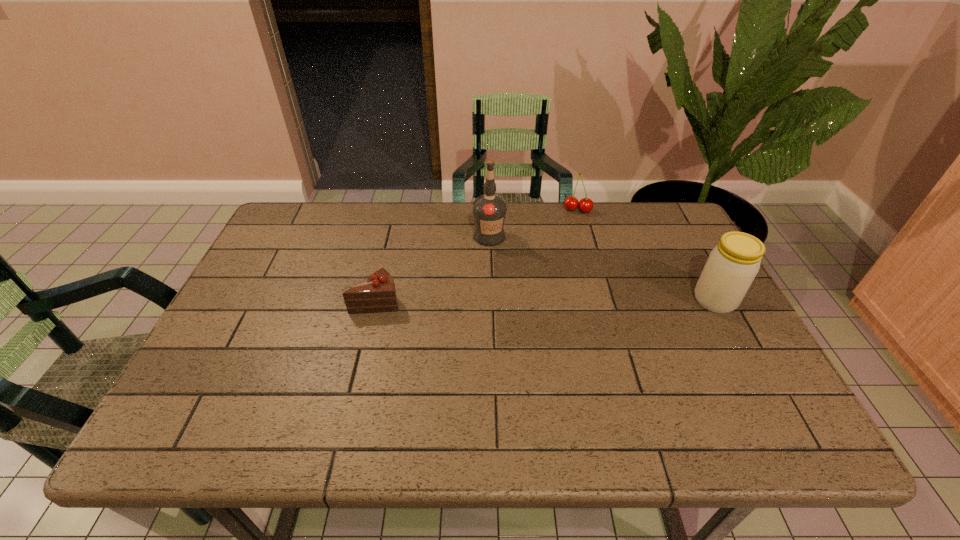
Where is `vacant point located between the farthest object and the second object from left to right`? The image size is (960, 540). vacant point located between the farthest object and the second object from left to right is located at coordinates (534, 223).

What are the coordinates of `vacant space that is in between the rightmost object and the vodka` in the screenshot? It's located at (602, 268).

This screenshot has width=960, height=540. Identify the location of free space that is in between the second tallest object and the second shortest object. [x=646, y=255].

Where is `free spot between the third tallest object and the leftmost object`? This screenshot has height=540, width=960. free spot between the third tallest object and the leftmost object is located at coordinates (477, 255).

At what (x,y) coordinates should I click in order to perform the action: click on free space that is in between the jar and the third object from right to left. Please return your answer as a coordinate pair (x, y). The height and width of the screenshot is (540, 960). Looking at the image, I should click on (602, 268).

Identify which object is the nearest to the shortest object. Please provide its 2D coordinates. Your answer should be formatted as a tuple, i.e. [(x, y)], where the tuple contains the x and y coordinates of a point satisfying the conditions above.

[(489, 210)]

Locate an element on the screen. object that can be found as the closest to the rightmost object is located at coordinates (571, 203).

Where is `vacant space that satisfies the following two spatial constraints: 1. on the back side of the jar; 2. on the right side of the chocolate cake`? vacant space that satisfies the following two spatial constraints: 1. on the back side of the jar; 2. on the right side of the chocolate cake is located at coordinates (376, 300).

I want to click on free space that satisfies the following two spatial constraints: 1. on the front side of the tallest object; 2. on the left side of the rightmost object, so click(x=491, y=300).

Locate an element on the screen. free spot that satisfies the following two spatial constraints: 1. on the front side of the second object from right to left; 2. on the left side of the second tallest object is located at coordinates (603, 300).